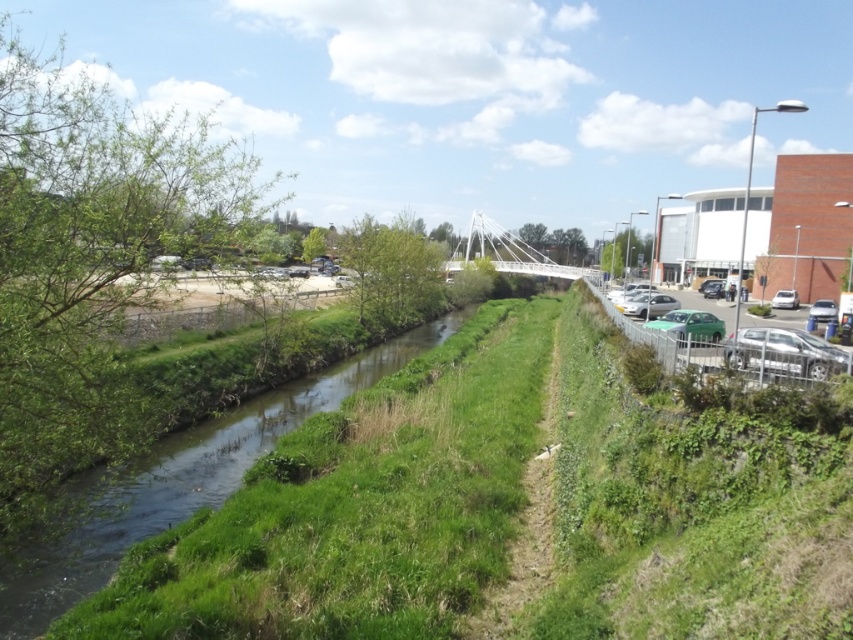
Can you confirm if silver metallic car at center-right is bigger than white glossy sedan at right?

Yes.

Is the position of silver metallic car at center-right more distant than that of white glossy sedan at right?

No, silver metallic car at center-right is closer to the viewer.

What do you see at coordinates (648, 305) in the screenshot? I see `silver metallic car at center-right` at bounding box center [648, 305].

Where is `silver metallic car at center-right`? This screenshot has height=640, width=853. silver metallic car at center-right is located at coordinates (648, 305).

Is green grassy stream at center positioned before metallic silver car at right?

That is True.

Does green grassy stream at center appear over metallic silver car at right?

Incorrect, green grassy stream at center is not positioned above metallic silver car at right.

Is point (184, 468) closer to camera compared to point (831, 301)?

Yes, it is.

At what (x,y) coordinates should I click in order to perform the action: click on green grassy stream at center. Please return your answer as a coordinate pair (x, y). Image resolution: width=853 pixels, height=640 pixels. Looking at the image, I should click on (171, 484).

Between silver metallic car at center-right and metallic silver car at right, which one has less height?

metallic silver car at right is shorter.

Where is `silver metallic car at center-right`? The image size is (853, 640). silver metallic car at center-right is located at coordinates (648, 305).